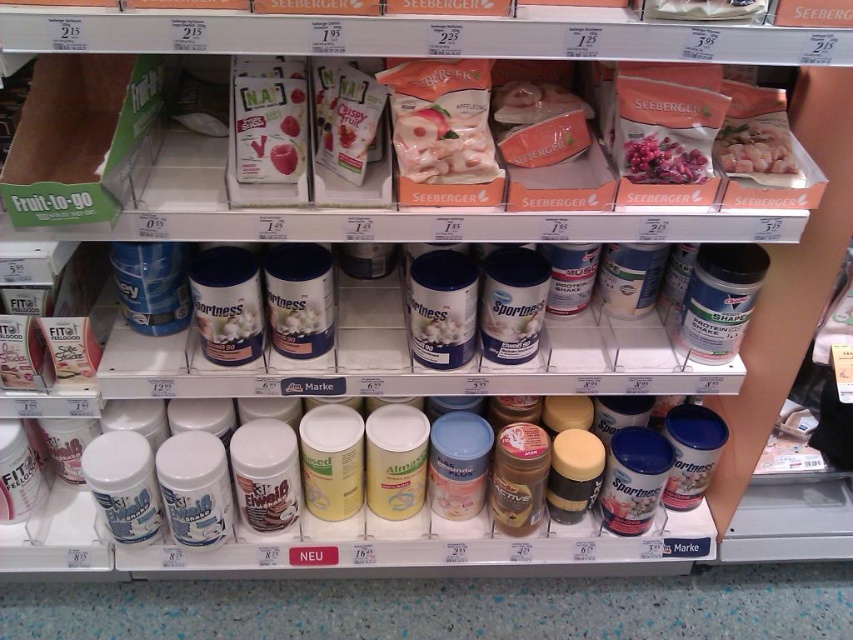
This screenshot has height=640, width=853. What do you see at coordinates (442, 140) in the screenshot? I see `pink matte snack at center` at bounding box center [442, 140].

You are a GUI agent. You are given a task and a screenshot of the screen. Output one action in this format:
    pyautogui.click(x=<x>, y=<y>)
    Task: Click on the pink matte snack at center
    This screenshot has height=640, width=853.
    Given the screenshot: What is the action you would take?
    pyautogui.click(x=442, y=140)

Locate an element on the screen. pink matte snack at center is located at coordinates (442, 140).

Between pink matte snack at center and pink matte dried fruit at center, which one has less height?

pink matte dried fruit at center is shorter.

Can you confirm if pink matte snack at center is positioned above pink matte dried fruit at center?

Yes, pink matte snack at center is above pink matte dried fruit at center.

Identify the location of pink matte snack at center. (442, 140).

Is white glossy chicken at upper right taller than pink matte dried fruit at center?

Correct, white glossy chicken at upper right is much taller as pink matte dried fruit at center.

Measure the distance between white glossy chicken at upper right and camera.

The distance of white glossy chicken at upper right from camera is 3.31 feet.

I want to click on white glossy chicken at upper right, so click(753, 147).